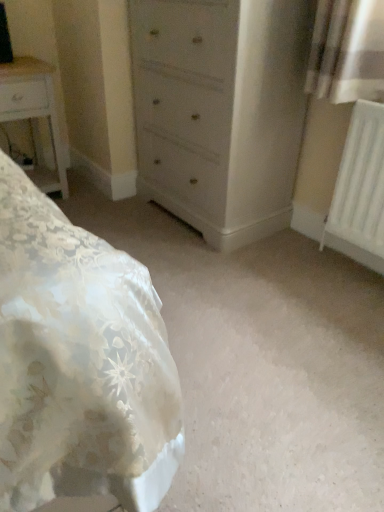
Question: From the image's perspective, relative to white glossy nightstand at left, is light gray wood chest of drawers at center above or below?

Choices:
 (A) below
 (B) above

Answer: (B)

Question: In terms of width, does light gray wood chest of drawers at center look wider or thinner when compared to white glossy nightstand at left?

Choices:
 (A) thin
 (B) wide

Answer: (B)

Question: Based on their relative distances, which object is nearer to the white glossy nightstand at left?

Choices:
 (A) light gray wood chest of drawers at center
 (B) white plastic radiator at right

Answer: (A)

Question: Estimate the real-world distances between objects in this image. Which object is closer to the white glossy nightstand at left?

Choices:
 (A) light gray wood chest of drawers at center
 (B) white plastic radiator at right

Answer: (A)